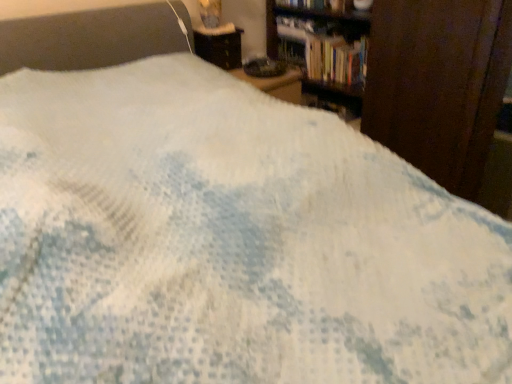
Measure the distance between hardcover book at upper right and camera.

The distance of hardcover book at upper right from camera is 7.54 feet.

Image resolution: width=512 pixels, height=384 pixels. What do you see at coordinates (336, 59) in the screenshot?
I see `hardcover book at upper right` at bounding box center [336, 59].

In order to click on hardcover book at upper right in this screenshot , I will do `click(336, 59)`.

This screenshot has height=384, width=512. Identify the location of hardcover book at upper right. (336, 59).